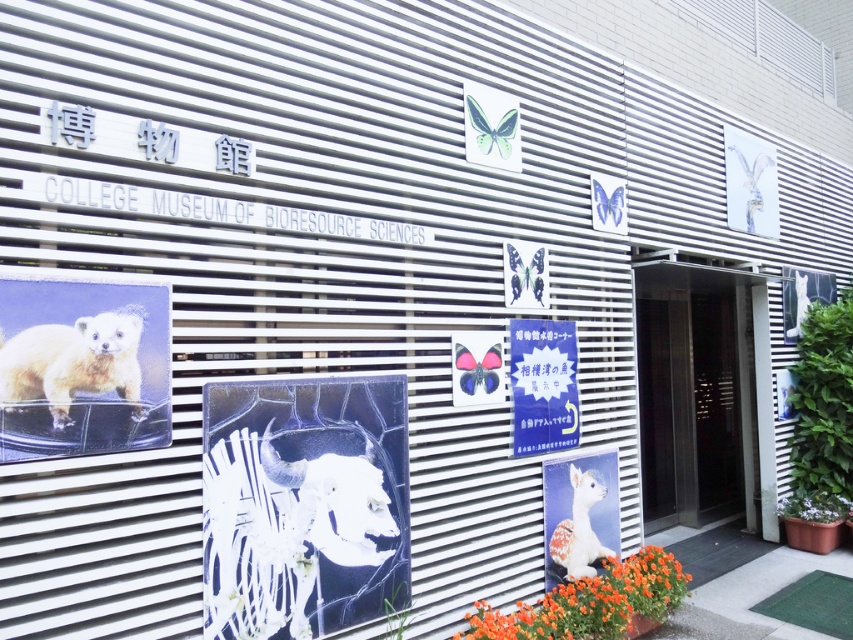
You are standing in front of the College Museum of Biorsource Sciences. You see a fuzzy yellow fur at left and a blue paper sign at center. Which object is taller?

The blue paper sign at center is taller than the fuzzy yellow fur at left.

You are a delivery person carrying a package that is 1.2 meters wide. You need to enter the building and use the elevator. Can the metallic silver elevator at center accommodate your package? Please consider the width of the elevator and the orange matte flower at lower center.

The metallic silver elevator at center is wider than the orange matte flower at lower center. However, the exact width of the elevator is not provided. Without knowing the actual dimensions, it is impossible to determine if the elevator can fit the 1.2 meter wide package.

You are a visitor at the College Museum of Biorsource Sciences. You see a white glossy ram head at center and a blue paper sign at center. Which object is positioned higher on the wall?

The blue paper sign at center is positioned higher on the wall than the white glossy ram head at center.